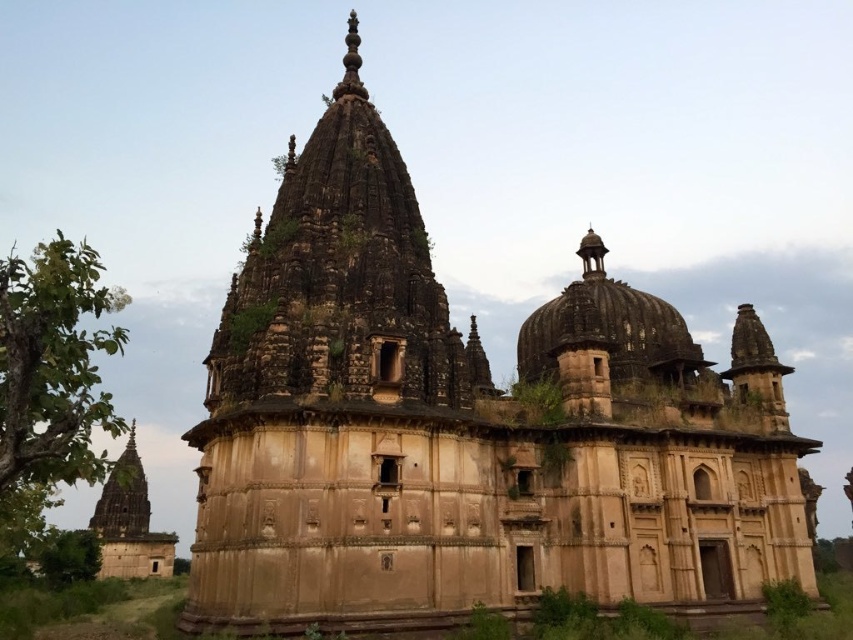
Based on the photo, which is more to the right, brown stone dome at center or brown stone tower at lower left?

brown stone dome at center is more to the right.

Consider the image. Is brown stone dome at center to the right of brown stone tower at lower left from the viewer's perspective?

Yes, brown stone dome at center is to the right of brown stone tower at lower left.

This screenshot has width=853, height=640. Find the location of `brown stone dome at center`. brown stone dome at center is located at coordinates (610, 326).